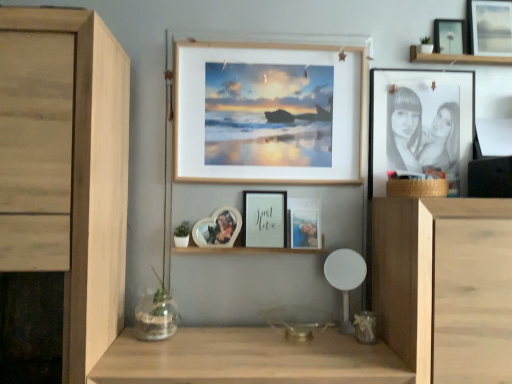
At what (x,y) coordinates should I click in order to perform the action: click on empty space that is ontop of wooden frame at upper center, the third picture frame from the left. Please return your answer as a coordinate pair (x, y). Looking at the image, I should click on (273, 41).